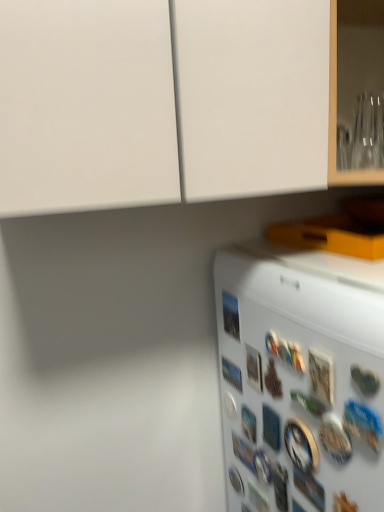
Question: Is white plastic button at lower right, acting as the ninth button starting from the front, positioned before white plastic button at lower center, marked as the twelfth button in a front-to-back arrangement?

Choices:
 (A) yes
 (B) no

Answer: (A)

Question: From a real-world perspective, is white plastic button at lower right, acting as the ninth button starting from the front, on top of white plastic button at lower center, marked as the twelfth button in a front-to-back arrangement?

Choices:
 (A) yes
 (B) no

Answer: (B)

Question: Is white plastic button at lower right, acting as the ninth button starting from the front, at the left side of white plastic button at lower center, which is the second button in back-to-front order?

Choices:
 (A) yes
 (B) no

Answer: (B)

Question: Are white plastic button at lower right, acting as the ninth button starting from the front, and white plastic button at lower center, which is the second button in back-to-front order, located far from each other?

Choices:
 (A) no
 (B) yes

Answer: (A)

Question: Is white plastic button at lower center, marked as the twelfth button in a front-to-back arrangement, a part of white plastic button at lower right, acting as the ninth button starting from the front?

Choices:
 (A) yes
 (B) no

Answer: (B)

Question: Is white plastic button at lower right, which is the fifth button from back to front, wider than white plastic button at lower center, marked as the twelfth button in a front-to-back arrangement?

Choices:
 (A) yes
 (B) no

Answer: (A)

Question: From the image's perspective, is metallic silver button at lower right, the 3th button from the front, under white matte refrigerator at lower right?

Choices:
 (A) no
 (B) yes

Answer: (A)

Question: Is metallic silver button at lower right, the 11th button in the back-to-front sequence, oriented towards white matte refrigerator at lower right?

Choices:
 (A) no
 (B) yes

Answer: (A)

Question: From a real-world perspective, is metallic silver button at lower right, the 3th button from the front, over white matte refrigerator at lower right?

Choices:
 (A) yes
 (B) no

Answer: (A)

Question: Does metallic silver button at lower right, the 3th button from the front, appear on the left side of white matte refrigerator at lower right?

Choices:
 (A) no
 (B) yes

Answer: (B)

Question: Is metallic silver button at lower right, the 3th button from the front, positioned before white matte refrigerator at lower right?

Choices:
 (A) no
 (B) yes

Answer: (A)

Question: Is metallic silver button at lower right, the 11th button in the back-to-front sequence, oriented away from white matte refrigerator at lower right?

Choices:
 (A) yes
 (B) no

Answer: (A)

Question: Is metallic silver button at lower right, which is the tenth button in back-to-front order, in front of white plastic button at lower center, which is the second button in back-to-front order?

Choices:
 (A) no
 (B) yes

Answer: (B)